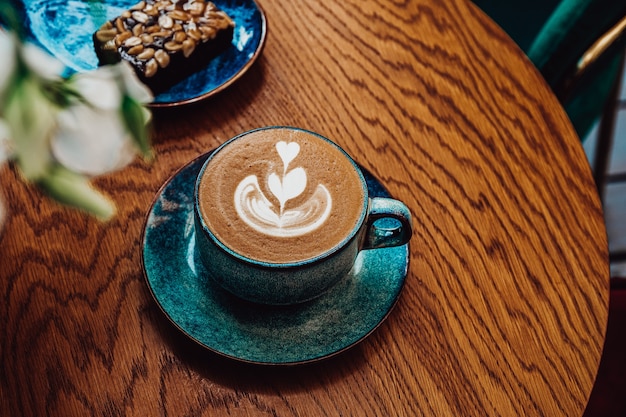
Where is `mug`? This screenshot has height=417, width=626. mug is located at coordinates (289, 285).